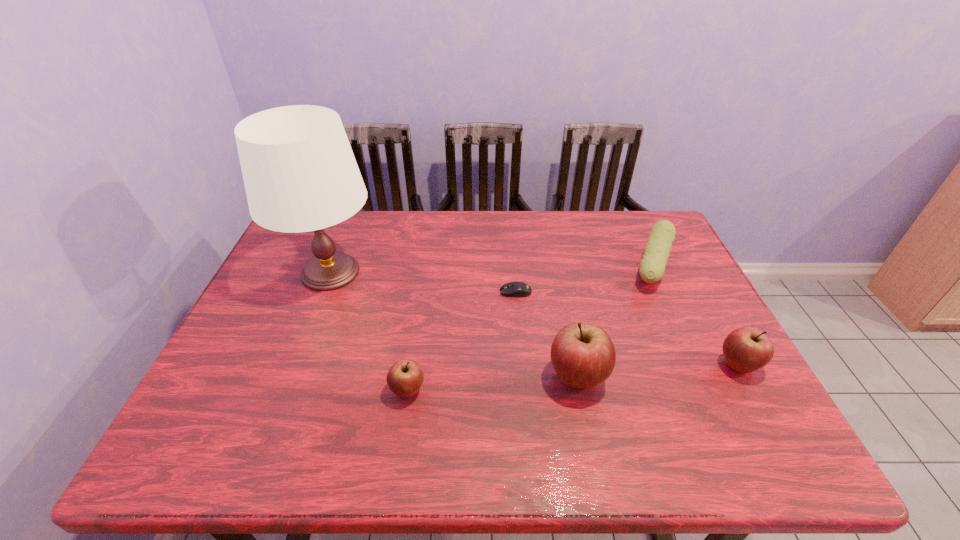
I want to click on vacant place for an extra apple on the left, so click(228, 405).